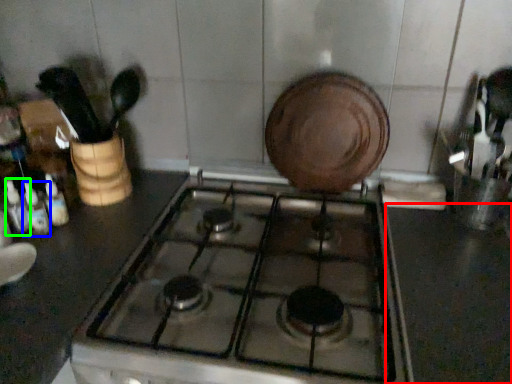
Question: Based on their relative distances, which object is farther from counter top (highlighted by a red box)? Choose from bottle (highlighted by a blue box) and bottle (highlighted by a green box).

Choices:
 (A) bottle
 (B) bottle

Answer: (B)